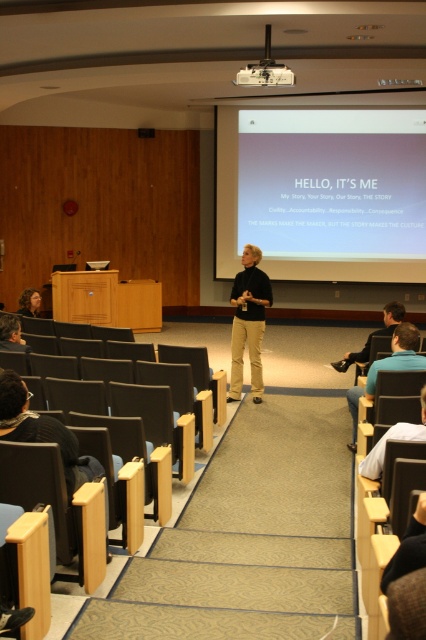
You are sitting in the black plastic chair at center in a lecture hall. You need to reach the remote or clicker that the presenter is holding. Can you directly hand it to her without leaving your seat?

No, you cannot directly hand the remote or clicker to the presenter because the black plastic chair at center is located at point (163,481), which is likely too far away for you to reach her from your seat.